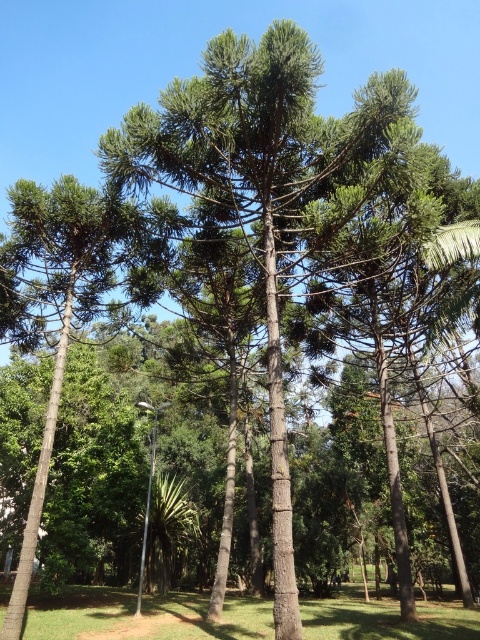
Question: Which object appears farthest from the camera in this image?

Choices:
 (A) green textured pine tree at center
 (B) green grass at lower center

Answer: (B)

Question: Which of the following is the farthest from the observer?

Choices:
 (A) green textured pine tree at center
 (B) green grass at lower center

Answer: (B)

Question: Which object is closer to the camera taking this photo?

Choices:
 (A) green grass at lower center
 (B) green textured pine tree at center

Answer: (B)

Question: Does green textured pine tree at center have a larger size compared to green grass at lower center?

Choices:
 (A) yes
 (B) no

Answer: (B)

Question: Is green textured pine tree at center above green grass at lower center?

Choices:
 (A) no
 (B) yes

Answer: (B)

Question: Observing the image, what is the correct spatial positioning of green textured pine tree at center in reference to green grass at lower center?

Choices:
 (A) below
 (B) above

Answer: (B)